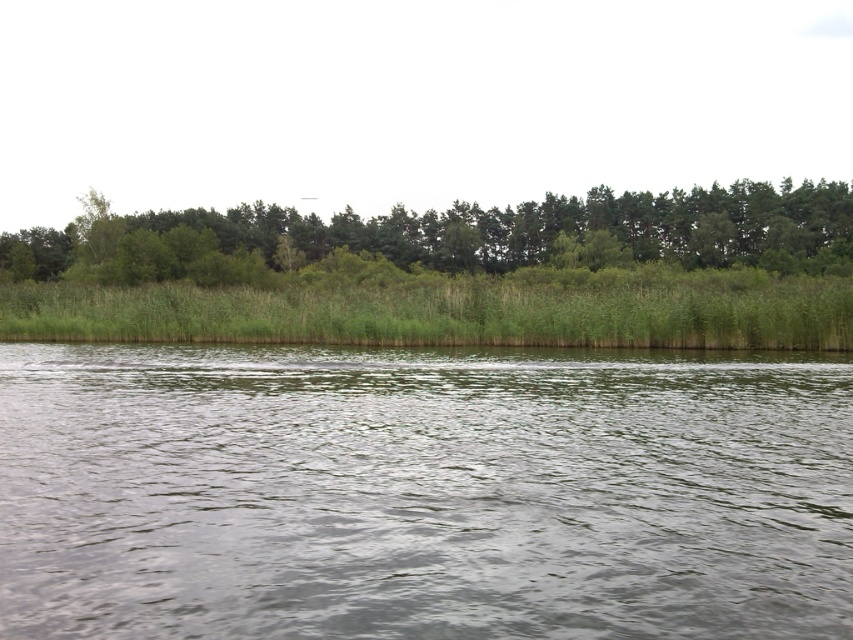
Looking at this image, you are standing at the edge of the water and looking towards the forest. Which object, the green water at center or the green leafy trees at upper center, is closer to you?

The green water at center is closer to you because it is positioned in front of the green leafy trees at upper center.

You are standing at the edge of the water in the scene. If you want to reach the dense forest in the background, which direction should you move relative to the green water at center?

To reach the dense forest in the background, you should move away from the green water at center since the forest is located behind it.